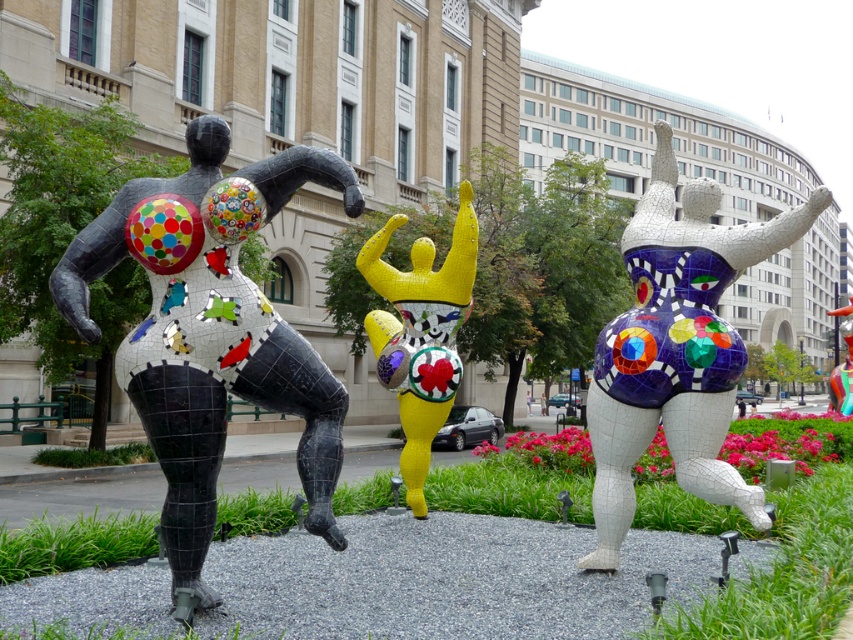
You are an art student trying to sketch the sculptures. You want to ensure that the proportions between the black mosaic figure at left and the shiny yellow mosaic figure at center are accurate. Which one should you draw taller?

The shiny yellow mosaic figure at center is taller than the black mosaic figure at left, so you should draw the shiny yellow mosaic figure at center taller.

You are standing at the center of the paved area and want to locate the black mosaic figure at left. According to the coordinates provided, which direction should you move to find it?

The black mosaic figure at left is located at coordinates point (212, 330), so you should move to the left side of the paved area to find it.